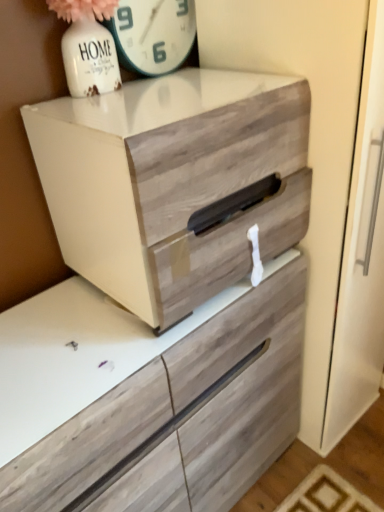
Question: From a real-world perspective, is white glossy clock at upper center physically located above or below wooden drawer at center?

Choices:
 (A) below
 (B) above

Answer: (B)

Question: Considering the positions of white glossy clock at upper center and wooden drawer at center in the image, is white glossy clock at upper center wider or thinner than wooden drawer at center?

Choices:
 (A) thin
 (B) wide

Answer: (A)

Question: Considering the relative positions of white glossy clock at upper center and wooden drawer at center in the image provided, is white glossy clock at upper center to the left or to the right of wooden drawer at center?

Choices:
 (A) right
 (B) left

Answer: (B)

Question: Looking at their shapes, would you say wooden drawer at center is wider or thinner than white glossy clock at upper center?

Choices:
 (A) wide
 (B) thin

Answer: (A)

Question: In terms of height, does wooden drawer at center look taller or shorter compared to white glossy clock at upper center?

Choices:
 (A) tall
 (B) short

Answer: (A)

Question: From the image's perspective, is wooden drawer at center above or below white glossy clock at upper center?

Choices:
 (A) above
 (B) below

Answer: (B)

Question: Based on their sizes in the image, would you say wooden drawer at center is bigger or smaller than white glossy clock at upper center?

Choices:
 (A) small
 (B) big

Answer: (B)